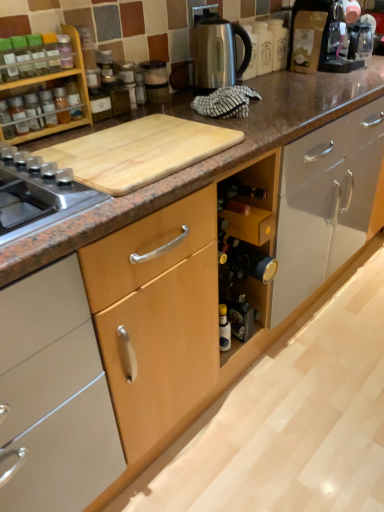
Question: Is matte glass bottle at left, the 3th bottle viewed from the right, a part of satin silver kettle at upper center, the first appliance positioned from the right?

Choices:
 (A) no
 (B) yes

Answer: (A)

Question: Does satin silver kettle at upper center, which appears as the second appliance when viewed from the left, have a lesser height compared to matte glass bottle at left, the 3th bottle viewed from the right?

Choices:
 (A) no
 (B) yes

Answer: (A)

Question: Is satin silver kettle at upper center, which appears as the second appliance when viewed from the left, positioned with its back to matte glass bottle at left, positioned as the 1th bottle in left-to-right order?

Choices:
 (A) no
 (B) yes

Answer: (A)

Question: Is satin silver kettle at upper center, the first appliance positioned from the right, positioned behind matte glass bottle at left, positioned as the 1th bottle in left-to-right order?

Choices:
 (A) no
 (B) yes

Answer: (B)

Question: Considering the relative sizes of satin silver kettle at upper center, which appears as the second appliance when viewed from the left, and matte glass bottle at left, positioned as the 1th bottle in left-to-right order, in the image provided, is satin silver kettle at upper center, which appears as the second appliance when viewed from the left, wider than matte glass bottle at left, positioned as the 1th bottle in left-to-right order,?

Choices:
 (A) yes
 (B) no

Answer: (A)

Question: Choose the correct answer: Is green glass wine bottle at center inside natural wood cutting board at upper left or outside it?

Choices:
 (A) outside
 (B) inside

Answer: (A)

Question: Considering the relative positions of green glass wine bottle at center and natural wood cutting board at upper left in the image provided, is green glass wine bottle at center to the left or to the right of natural wood cutting board at upper left?

Choices:
 (A) left
 (B) right

Answer: (B)

Question: From a real-world perspective, is green glass wine bottle at center above or below natural wood cutting board at upper left?

Choices:
 (A) below
 (B) above

Answer: (A)

Question: Is point (231, 306) closer or farther from the camera than point (130, 173)?

Choices:
 (A) farther
 (B) closer

Answer: (A)

Question: In the image, is metallic silver blender at upper center, marked as the 2th appliance in a right-to-left arrangement, on the left side or the right side of satin silver kettle at upper center, which appears as the second appliance when viewed from the left?

Choices:
 (A) right
 (B) left

Answer: (B)

Question: Does point (153, 77) appear closer or farther from the camera than point (215, 6)?

Choices:
 (A) closer
 (B) farther

Answer: (A)

Question: From a real-world perspective, relative to satin silver kettle at upper center, which appears as the second appliance when viewed from the left, is metallic silver blender at upper center, marked as the 2th appliance in a right-to-left arrangement, vertically above or below?

Choices:
 (A) below
 (B) above

Answer: (A)

Question: Considering the positions of metallic silver blender at upper center, positioned as the first appliance in left-to-right order, and satin silver kettle at upper center, which appears as the second appliance when viewed from the left, in the image, is metallic silver blender at upper center, positioned as the first appliance in left-to-right order, wider or thinner than satin silver kettle at upper center, which appears as the second appliance when viewed from the left,?

Choices:
 (A) thin
 (B) wide

Answer: (A)

Question: Relative to satin silver kettle at upper center, the first appliance positioned from the right, is translucent glass spice at upper left, the second bottle in the left-to-right sequence, in front or behind?

Choices:
 (A) front
 (B) behind

Answer: (A)

Question: From a real-world perspective, relative to satin silver kettle at upper center, the first appliance positioned from the right, is translucent glass spice at upper left, the 2th bottle when ordered from right to left, vertically above or below?

Choices:
 (A) above
 (B) below

Answer: (B)